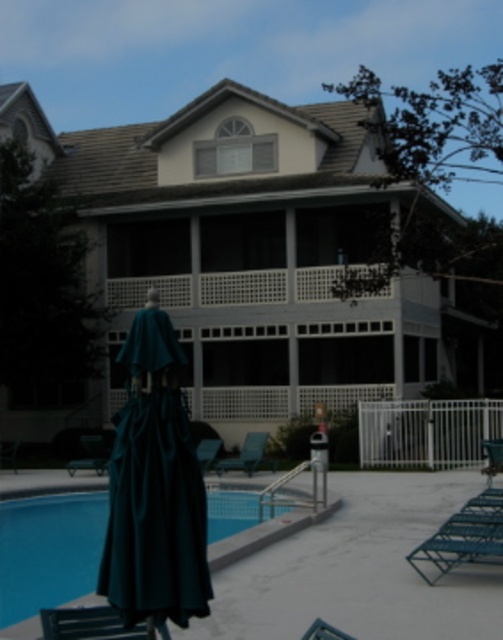
Question: Which is farther from the blue glossy pool at lower left?

Choices:
 (A) teal fabric robe at lower left
 (B) metallic blue lounge chair at lower right
 (C) metallic silver beach chair at lower right
 (D) teal fabric beach chair at lower left

Answer: (A)

Question: Among these points, which one is nearest to the camera?

Choices:
 (A) (167, 465)
 (B) (103, 620)
 (C) (102, 445)
 (D) (7, 600)

Answer: (A)

Question: Does teal fabric robe at lower left have a lesser width compared to teal fabric chair at lower center?

Choices:
 (A) yes
 (B) no

Answer: (A)

Question: Is blue glossy pool at lower left to the left of metallic blue chair at lower left from the viewer's perspective?

Choices:
 (A) yes
 (B) no

Answer: (A)

Question: Which point is closer to the camera?

Choices:
 (A) (54, 636)
 (B) (468, 541)

Answer: (A)

Question: Is metallic blue lounge chair at lower right wider than teal fabric chair at lower center?

Choices:
 (A) no
 (B) yes

Answer: (B)